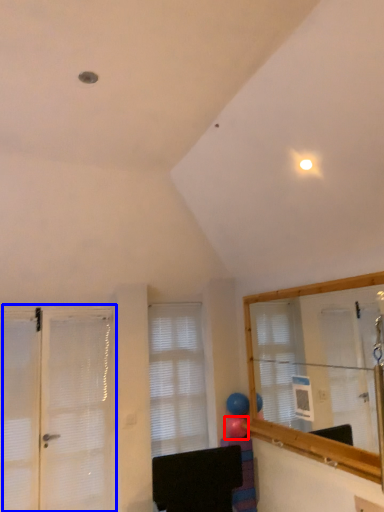
Question: Which of the following is the closest to the observer, balloon (highlighted by a red box) or door (highlighted by a blue box)?

Choices:
 (A) balloon
 (B) door

Answer: (B)